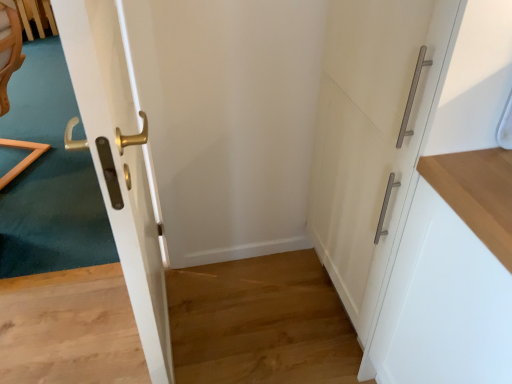
The width and height of the screenshot is (512, 384). Describe the element at coordinates (477, 192) in the screenshot. I see `white matte cabinet at right` at that location.

The height and width of the screenshot is (384, 512). What do you see at coordinates (119, 162) in the screenshot?
I see `glossy white door at left, marked as the first door in a left-to-right arrangement` at bounding box center [119, 162].

The height and width of the screenshot is (384, 512). What do you see at coordinates (370, 136) in the screenshot? I see `white matte cabinet handle at right, the second door in the left-to-right sequence` at bounding box center [370, 136].

Find the location of `white matte cabinet at right`. white matte cabinet at right is located at coordinates (477, 192).

Between point (353, 188) and point (494, 171), which one is positioned in front?

The point (494, 171) is closer to the camera.

Is white matte cabinet handle at right, the second door in the left-to-right sequence, not within white matte cabinet at right?

Yes.

Consider the image. From the image's perspective, is white matte cabinet handle at right, the second door in the left-to-right sequence, on top of white matte cabinet at right?

Indeed, from the image's perspective, white matte cabinet handle at right, the second door in the left-to-right sequence, is shown above white matte cabinet at right.

From a real-world perspective, is white matte cabinet handle at right, the second door in the left-to-right sequence, over white matte cabinet at right?

Correct, in the physical world, white matte cabinet handle at right, the second door in the left-to-right sequence, is higher than white matte cabinet at right.

Which of these two, glossy white door at left, marked as the first door in a left-to-right arrangement, or white matte cabinet handle at right, the second door in the left-to-right sequence, stands shorter?

white matte cabinet handle at right, the second door in the left-to-right sequence.

From the image's perspective, which one is positioned lower, glossy white door at left, marked as the first door in a left-to-right arrangement, or white matte cabinet handle at right, the second door in the left-to-right sequence?

glossy white door at left, marked as the first door in a left-to-right arrangement, appears lower in the image.

Which is in front, point (69, 140) or point (369, 170)?

The point (369, 170) is more forward.

Considering the positions of objects glossy white door at left, which is the second door from right to left, and white matte cabinet handle at right, the second door in the left-to-right sequence, in the image provided, who is in front, glossy white door at left, which is the second door from right to left, or white matte cabinet handle at right, the second door in the left-to-right sequence,?

glossy white door at left, which is the second door from right to left, is closer to the camera.

How many degrees apart are the facing directions of glossy white door at left, which is the second door from right to left, and white matte cabinet at right?

They differ by 1.6 degrees in their facing directions.

Who is taller, glossy white door at left, which is the second door from right to left, or white matte cabinet at right?

glossy white door at left, which is the second door from right to left.

Based on the photo, which object is positioned more to the left, glossy white door at left, which is the second door from right to left, or white matte cabinet at right?

glossy white door at left, which is the second door from right to left.

Is glossy white door at left, which is the second door from right to left, not near white matte cabinet at right?

That's not correct — glossy white door at left, which is the second door from right to left, is a little close to white matte cabinet at right.

Is there a large distance between white matte cabinet at right and glossy white door at left, marked as the first door in a left-to-right arrangement?

That's not correct — white matte cabinet at right is a little close to glossy white door at left, marked as the first door in a left-to-right arrangement.

Looking at this image, is white matte cabinet at right positioned with its back to glossy white door at left, which is the second door from right to left?

white matte cabinet at right does not have its back to glossy white door at left, which is the second door from right to left.

From the image's perspective, is white matte cabinet at right located above glossy white door at left, which is the second door from right to left?

Incorrect, from the image's perspective, white matte cabinet at right is lower than glossy white door at left, which is the second door from right to left.

Does white matte cabinet at right lie behind white matte cabinet handle at right, the second door in the left-to-right sequence?

No, it is in front of white matte cabinet handle at right, the second door in the left-to-right sequence.

From the image's perspective, is white matte cabinet at right over white matte cabinet handle at right, which appears as the 1th door when viewed from the right?

No, from the image's perspective, white matte cabinet at right is not above white matte cabinet handle at right, which appears as the 1th door when viewed from the right.

Is point (476, 225) positioned after point (367, 226)?

No.

Does white matte cabinet at right have a greater width compared to white matte cabinet handle at right, which appears as the 1th door when viewed from the right?

In fact, white matte cabinet at right might be narrower than white matte cabinet handle at right, which appears as the 1th door when viewed from the right.

Does point (350, 307) appear closer or farther from the camera than point (97, 159)?

Point (350, 307) appears to be farther away from the viewer than point (97, 159).

In the image, is white matte cabinet handle at right, the second door in the left-to-right sequence, positioned in front of or behind glossy white door at left, which is the second door from right to left?

In the image, white matte cabinet handle at right, the second door in the left-to-right sequence, appears behind glossy white door at left, which is the second door from right to left.

Looking at the image, does white matte cabinet handle at right, the second door in the left-to-right sequence, seem bigger or smaller compared to glossy white door at left, which is the second door from right to left?

Clearly, white matte cabinet handle at right, the second door in the left-to-right sequence, is larger in size than glossy white door at left, which is the second door from right to left.

At what (x,y) coordinates should I click in order to perform the action: click on door behind the white matte cabinet at right. Please return your answer as a coordinate pair (x, y). Looking at the image, I should click on (370, 136).

Find the location of a particular element. door located on the left of white matte cabinet handle at right, which appears as the 1th door when viewed from the right is located at coordinates (119, 162).

From the image, which object appears to be nearer to white matte cabinet handle at right, which appears as the 1th door when viewed from the right, glossy white door at left, marked as the first door in a left-to-right arrangement, or white matte cabinet at right?

The object closer to white matte cabinet handle at right, which appears as the 1th door when viewed from the right, is white matte cabinet at right.

Considering their positions, is white matte cabinet handle at right, the second door in the left-to-right sequence, positioned closer to glossy white door at left, marked as the first door in a left-to-right arrangement, than white matte cabinet at right?

white matte cabinet handle at right, the second door in the left-to-right sequence, is positioned closer to the anchor glossy white door at left, marked as the first door in a left-to-right arrangement.

Based on their spatial positions, is white matte cabinet at right or glossy white door at left, marked as the first door in a left-to-right arrangement, further from white matte cabinet handle at right, which appears as the 1th door when viewed from the right?

The object further to white matte cabinet handle at right, which appears as the 1th door when viewed from the right, is glossy white door at left, marked as the first door in a left-to-right arrangement.

When comparing their distances from glossy white door at left, marked as the first door in a left-to-right arrangement, does white matte cabinet at right or white matte cabinet handle at right, which appears as the 1th door when viewed from the right, seem closer?

white matte cabinet handle at right, which appears as the 1th door when viewed from the right, is positioned closer to the anchor glossy white door at left, marked as the first door in a left-to-right arrangement.

Based on their spatial positions, is white matte cabinet handle at right, which appears as the 1th door when viewed from the right, or glossy white door at left, marked as the first door in a left-to-right arrangement, closer to white matte cabinet at right?

white matte cabinet handle at right, which appears as the 1th door when viewed from the right.

Estimate the real-world distances between objects in this image. Which object is closer to white matte cabinet at right, glossy white door at left, marked as the first door in a left-to-right arrangement, or white matte cabinet handle at right, which appears as the 1th door when viewed from the right?

white matte cabinet handle at right, which appears as the 1th door when viewed from the right, is positioned closer to the anchor white matte cabinet at right.

Locate an element on the screen. door between glossy white door at left, marked as the first door in a left-to-right arrangement, and white matte cabinet at right is located at coordinates (370, 136).